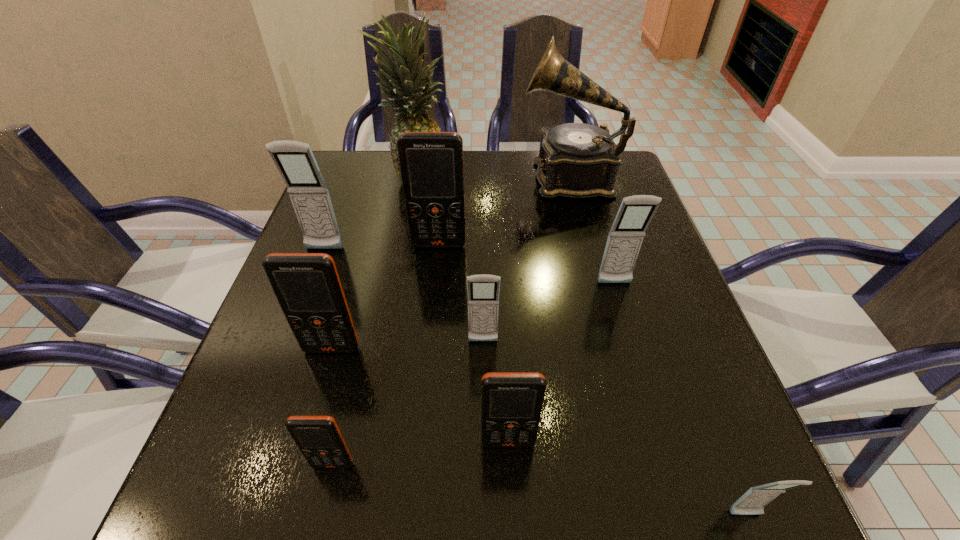
This screenshot has width=960, height=540. Find the location of `the second gray cellular telephone from left to right`. the second gray cellular telephone from left to right is located at coordinates pos(483,290).

Where is `the sixth farthest cellular telephone`? This screenshot has width=960, height=540. the sixth farthest cellular telephone is located at coordinates (511, 402).

Where is `the rightmost orange cellular telephone`? The height and width of the screenshot is (540, 960). the rightmost orange cellular telephone is located at coordinates (511, 402).

Find the location of a particular element. This screenshot has width=960, height=540. the second nearest cellular telephone is located at coordinates (319, 439).

You are a GUI agent. You are given a task and a screenshot of the screen. Output one action in this format:
    pyautogui.click(x=<x>, y=<y>)
    Task: Click on the nearest orange cellular telephone
    Image resolution: width=960 pixels, height=540 pixels.
    Given the screenshot: What is the action you would take?
    pyautogui.click(x=319, y=439)

Where is `the nearest cellular telephone`? This screenshot has width=960, height=540. the nearest cellular telephone is located at coordinates (753, 502).

This screenshot has height=540, width=960. Identify the location of the rightmost cellular telephone. (753, 502).

Find the location of a particular element. Image resolution: width=960 pixels, height=540 pixels. free region located on the right of the pineapple is located at coordinates (468, 175).

Identify the location of free space located on the horn of the ninth shortest object. The image size is (960, 540). (390, 177).

Where is `free space located 0.230m on the horn of the ninth shortest object`? free space located 0.230m on the horn of the ninth shortest object is located at coordinates (434, 177).